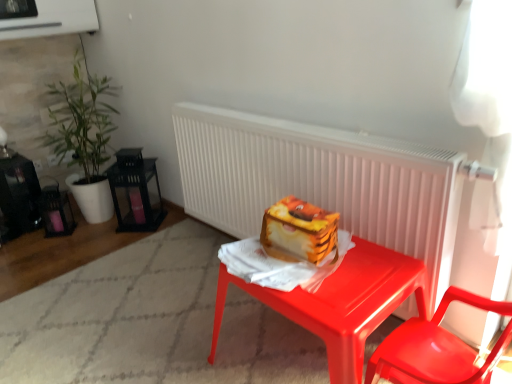
Question: Does white matte radiator at center have a greater width compared to green leafy plant at left?

Choices:
 (A) no
 (B) yes

Answer: (A)

Question: From a real-world perspective, is white matte radiator at center on top of green leafy plant at left?

Choices:
 (A) no
 (B) yes

Answer: (A)

Question: Is white matte radiator at center oriented away from green leafy plant at left?

Choices:
 (A) yes
 (B) no

Answer: (B)

Question: Is white matte radiator at center smaller than green leafy plant at left?

Choices:
 (A) no
 (B) yes

Answer: (B)

Question: Is white matte radiator at center positioned far away from green leafy plant at left?

Choices:
 (A) no
 (B) yes

Answer: (B)

Question: Would you say white matte radiator at center is to the left or to the right of glossy plastic desk at center in the picture?

Choices:
 (A) left
 (B) right

Answer: (A)

Question: Is point (225, 125) positioned closer to the camera than point (348, 281)?

Choices:
 (A) farther
 (B) closer

Answer: (A)

Question: Looking at their shapes, would you say white matte radiator at center is wider or thinner than glossy plastic desk at center?

Choices:
 (A) thin
 (B) wide

Answer: (A)

Question: From the image's perspective, is white matte radiator at center above or below glossy plastic desk at center?

Choices:
 (A) above
 (B) below

Answer: (A)

Question: From the image's perspective, is green leafy plant at left above or below glossy plastic chair at lower right?

Choices:
 (A) above
 (B) below

Answer: (A)

Question: Considering the positions of green leafy plant at left and glossy plastic chair at lower right in the image, is green leafy plant at left bigger or smaller than glossy plastic chair at lower right?

Choices:
 (A) big
 (B) small

Answer: (A)

Question: From their relative heights in the image, would you say green leafy plant at left is taller or shorter than glossy plastic chair at lower right?

Choices:
 (A) tall
 (B) short

Answer: (A)

Question: Considering the relative positions of green leafy plant at left and glossy plastic chair at lower right in the image provided, is green leafy plant at left to the left or to the right of glossy plastic chair at lower right?

Choices:
 (A) right
 (B) left

Answer: (B)

Question: Relative to white matte radiator at center, is glossy plastic desk at center in front or behind?

Choices:
 (A) front
 (B) behind

Answer: (A)

Question: From a real-world perspective, is glossy plastic desk at center positioned above or below white matte radiator at center?

Choices:
 (A) below
 (B) above

Answer: (A)